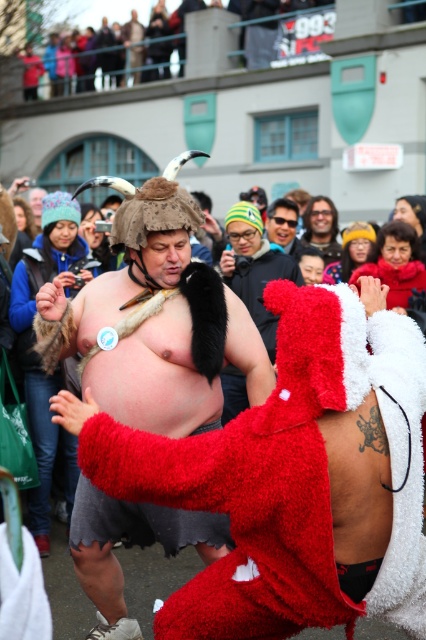
Can you confirm if fuzzy red santa at center is smaller than matte black jacket at upper center?

Indeed, fuzzy red santa at center has a smaller size compared to matte black jacket at upper center.

This screenshot has height=640, width=426. What are the coordinates of `fuzzy red santa at center` in the screenshot? It's located at (291, 477).

In order to click on fuzzy red santa at center in this screenshot , I will do `click(291, 477)`.

Is fuzzy red bear at center smaller than shiny black hair at center?

No.

Does fuzzy red bear at center come in front of shiny black hair at center?

That is True.

Is point (224, 372) closer to viewer compared to point (311, 202)?

That is True.

The height and width of the screenshot is (640, 426). What are the coordinates of `fuzzy red bear at center` in the screenshot? It's located at (255, 268).

Which is above, fuzzy red santa at center or shiny black hair at center?

shiny black hair at center is above.

Can you confirm if fuzzy red santa at center is thinner than shiny black hair at center?

No, fuzzy red santa at center is not thinner than shiny black hair at center.

Who is more distant from viewer, (400, 440) or (328, 253)?

Point (328, 253)

At what (x,y) coordinates should I click in order to perform the action: click on fuzzy red santa at center. Please return your answer as a coordinate pair (x, y). Looking at the image, I should click on (291, 477).